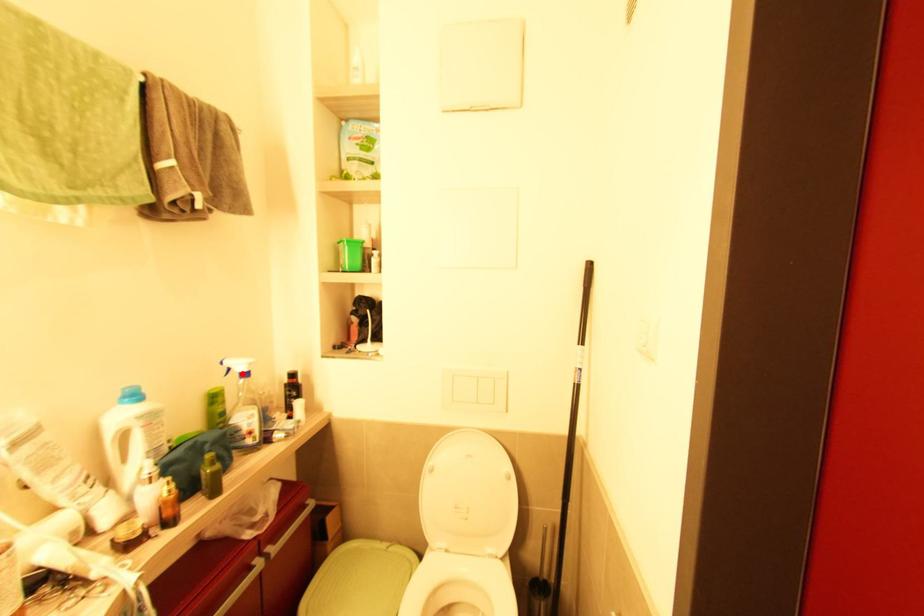
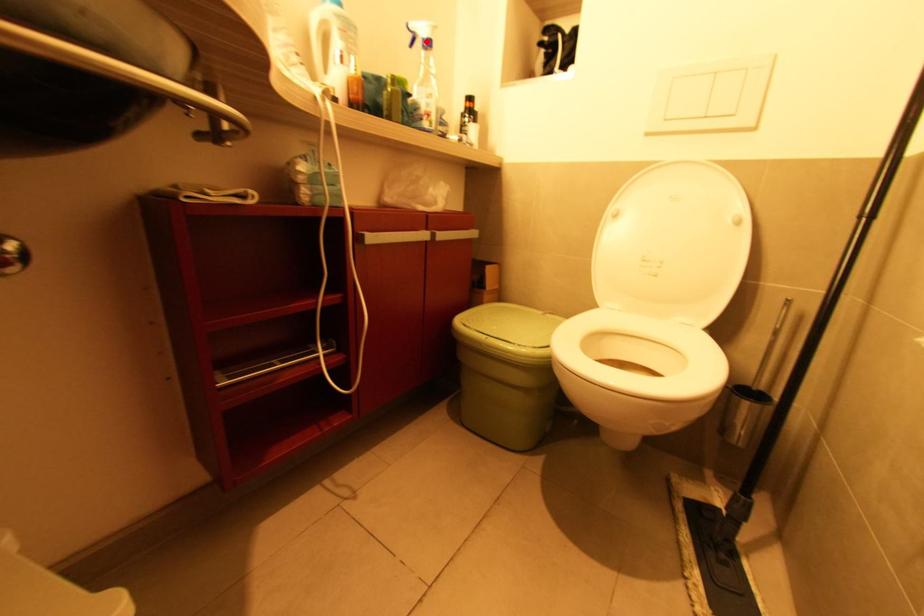
I am providing you with two images of the same scene from different viewpoints. A red point is marked on the first image and another point is marked on the second image. Do the highlighted points in image1 and image2 indicate the same real-world spot?

Yes